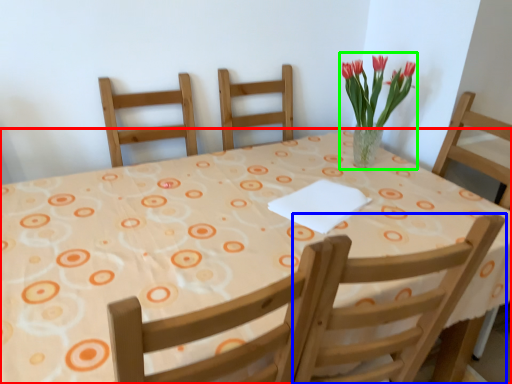
Question: Considering the real-world distances, which object is closest to table (highlighted by a red box)? chair (highlighted by a blue box) or floral arrangement (highlighted by a green box).

Choices:
 (A) chair
 (B) floral arrangement

Answer: (A)